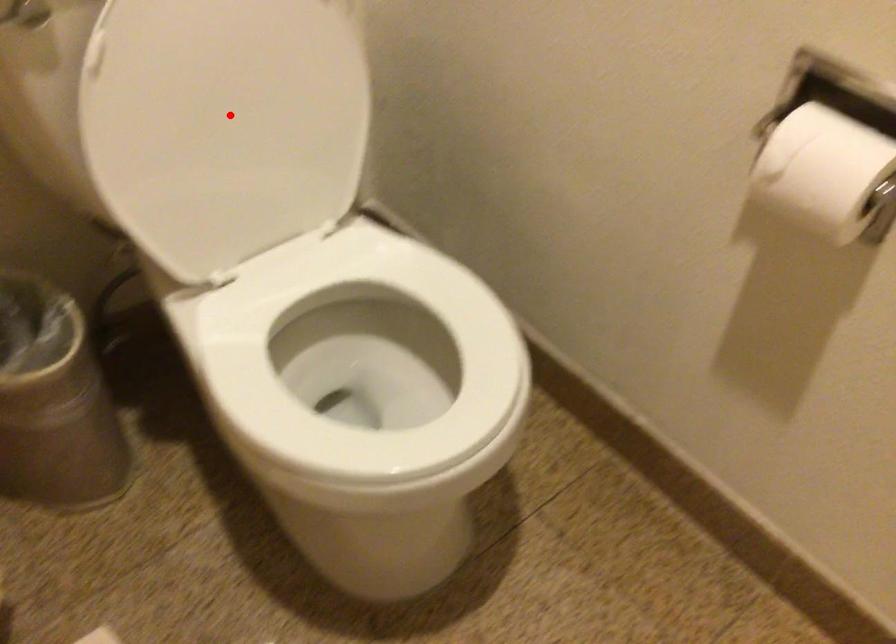
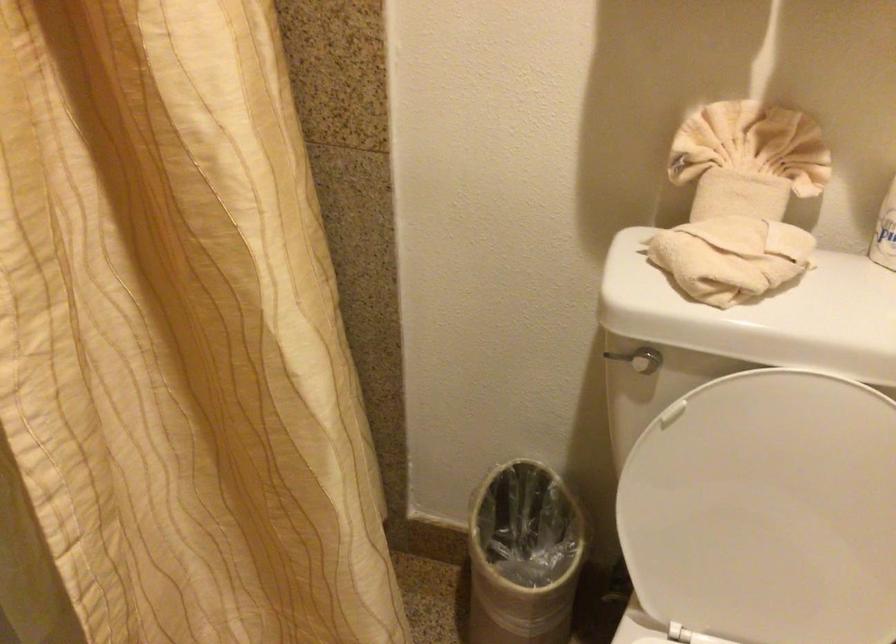
In the second image, find the point that corresponds to the highlighted location in the first image.

(767, 511)